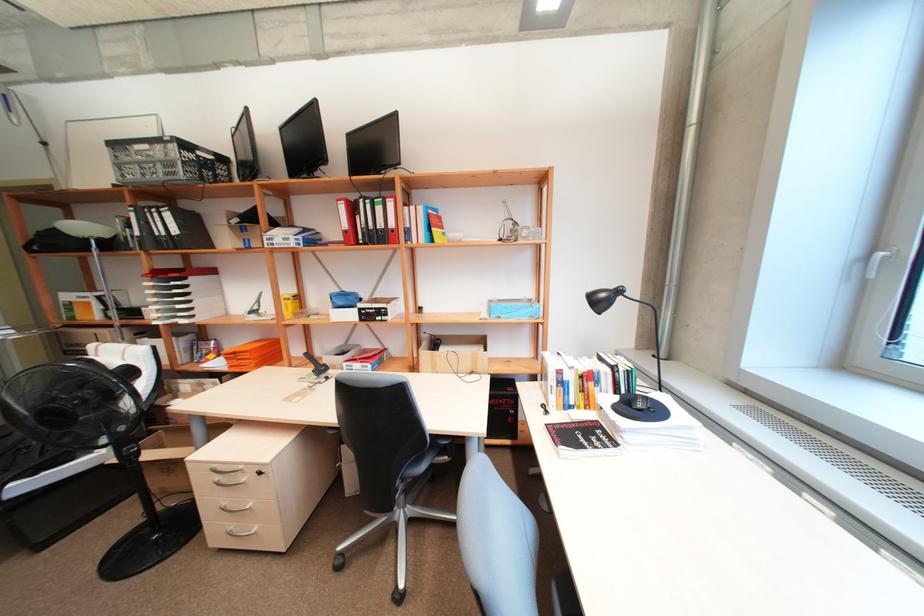
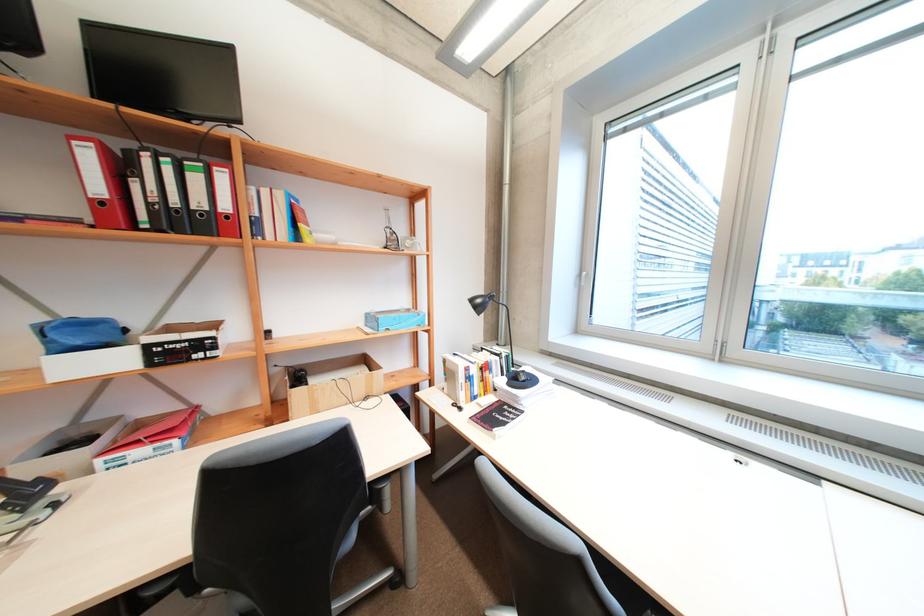
Question: The camera is either moving clockwise (left) or counter-clockwise (right) around the object. The first image is from the beginning of the video and the second image is from the end. Is the camera moving left or right when shooting the video?

Choices:
 (A) Left
 (B) Right

Answer: (A)